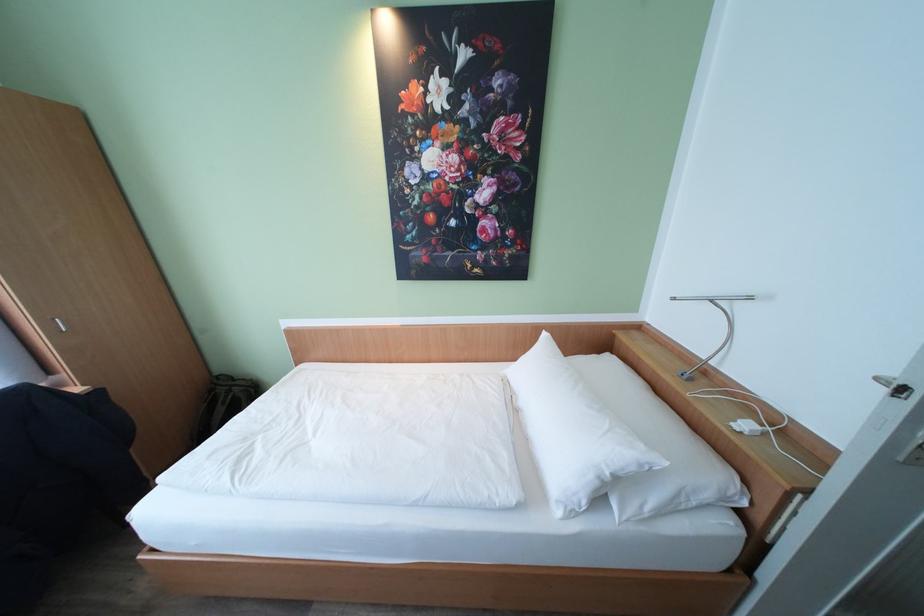
The image size is (924, 616). What are the coordinates of `dark green backpack` in the screenshot? It's located at (223, 403).